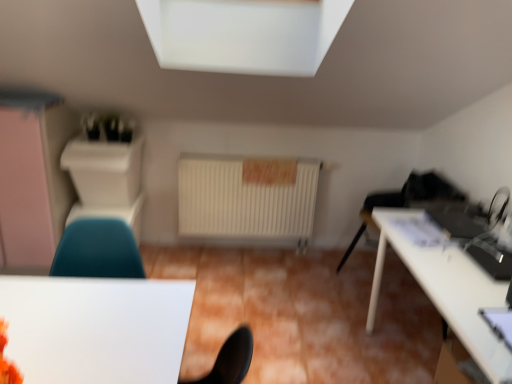
Question: Is white glossy table at lower left, which ranks as the 1th table in left-to-right order, positioned far away from matte white dresser at left?

Choices:
 (A) no
 (B) yes

Answer: (B)

Question: From the image's perspective, is white glossy table at lower left, which ranks as the 1th table in left-to-right order, on matte white dresser at left?

Choices:
 (A) yes
 (B) no

Answer: (B)

Question: Can you confirm if white glossy table at lower left, which ranks as the 1th table in left-to-right order, is thinner than matte white dresser at left?

Choices:
 (A) no
 (B) yes

Answer: (B)

Question: Considering the relative sizes of white glossy table at lower left, the 2th table from the right, and matte white dresser at left in the image provided, is white glossy table at lower left, the 2th table from the right, smaller than matte white dresser at left?

Choices:
 (A) yes
 (B) no

Answer: (A)

Question: Is white glossy table at lower left, the 2th table from the right, at the right side of matte white dresser at left?

Choices:
 (A) yes
 (B) no

Answer: (A)

Question: Considering the positions of matte white dresser at left and white glossy table at right, the second table positioned from the left, in the image, is matte white dresser at left wider or thinner than white glossy table at right, the second table positioned from the left,?

Choices:
 (A) wide
 (B) thin

Answer: (B)

Question: In terms of height, does matte white dresser at left look taller or shorter compared to white glossy table at right, which appears as the 1th table when viewed from the right?

Choices:
 (A) tall
 (B) short

Answer: (A)

Question: From a real-world perspective, is matte white dresser at left positioned above or below white glossy table at right, the second table positioned from the left?

Choices:
 (A) above
 (B) below

Answer: (A)

Question: Is matte white dresser at left situated inside white glossy table at right, which appears as the 1th table when viewed from the right, or outside?

Choices:
 (A) inside
 (B) outside

Answer: (B)

Question: Is matte white dresser at left in front of or behind white glossy table at lower left, which ranks as the 1th table in left-to-right order, in the image?

Choices:
 (A) front
 (B) behind

Answer: (B)

Question: Is point (26, 117) closer or farther from the camera than point (133, 370)?

Choices:
 (A) farther
 (B) closer

Answer: (A)

Question: In the image, is matte white dresser at left on the left side or the right side of white glossy table at lower left, which ranks as the 1th table in left-to-right order?

Choices:
 (A) left
 (B) right

Answer: (A)

Question: Considering the positions of matte white dresser at left and white glossy table at lower left, the 2th table from the right, in the image, is matte white dresser at left bigger or smaller than white glossy table at lower left, the 2th table from the right,?

Choices:
 (A) big
 (B) small

Answer: (A)

Question: In terms of width, does white glossy table at right, which appears as the 1th table when viewed from the right, look wider or thinner when compared to teal fabric chair at lower left?

Choices:
 (A) wide
 (B) thin

Answer: (A)

Question: Choose the correct answer: Is white glossy table at right, the second table positioned from the left, inside teal fabric chair at lower left or outside it?

Choices:
 (A) outside
 (B) inside

Answer: (A)